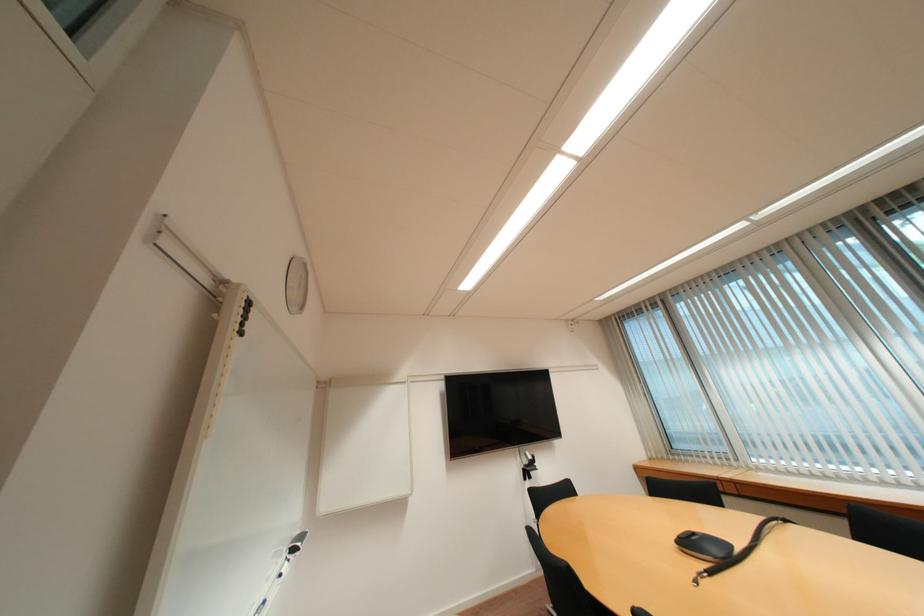
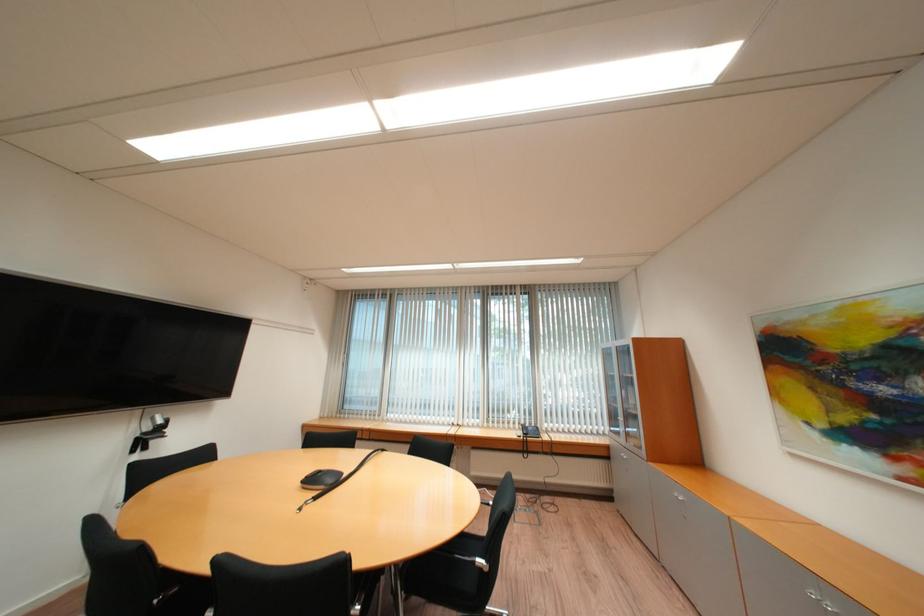
Where in the second image is the point corresponding to the point at 533,456 from the first image?

(162, 419)